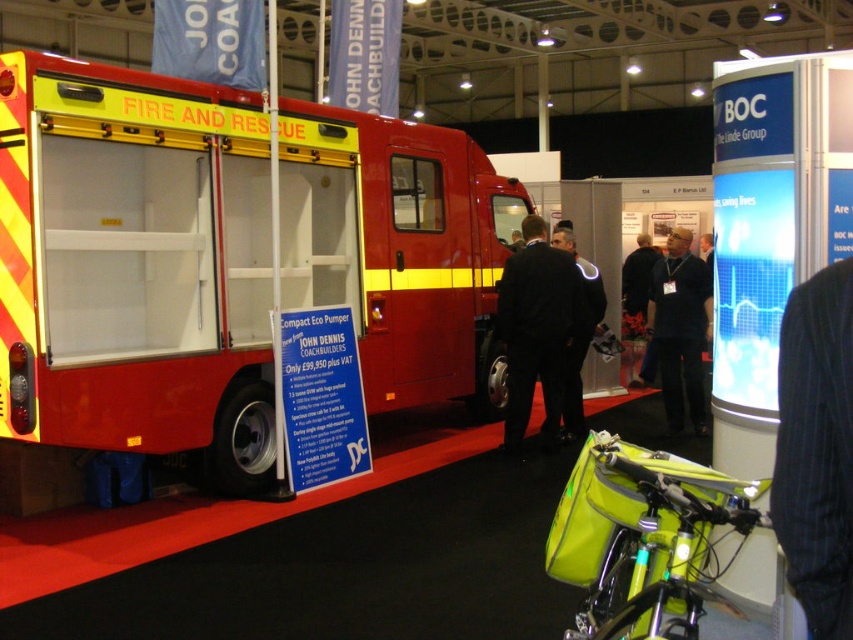
You are at the exhibition and want to take a photo of both the red matte fire truck at center and the neon yellow fabric bag at lower right. Which object should you position closer to the left side of your camera frame to include both in the shot?

To include both the red matte fire truck at center and the neon yellow fabric bag at lower right in your photo, position the red matte fire truck at center closer to the left side of your camera frame since it is already to the left of the neon yellow fabric bag at lower right.

You are a photographer setting up a shoot in the exhibition hall. You want to position a tripod so that both the red matte fire truck at center and the neon yellow fabric bag at lower right are visible in the frame. Given their height difference, which object will require you to adjust your camera angle upwards more?

The red matte fire truck at center is much taller than the neon yellow fabric bag at lower right, so you will need to tilt your camera upwards more to include the top of the red matte fire truck at center in the frame.

You are a photographer at the exhibition and want to take a photo of the dark blue shirt at center and the black fabric jacket at center. Which one is blocking the view of the other?

The black fabric jacket at center is behind dark blue shirt at center, so the dark blue shirt at center is blocking the view of the black fabric jacket at center.